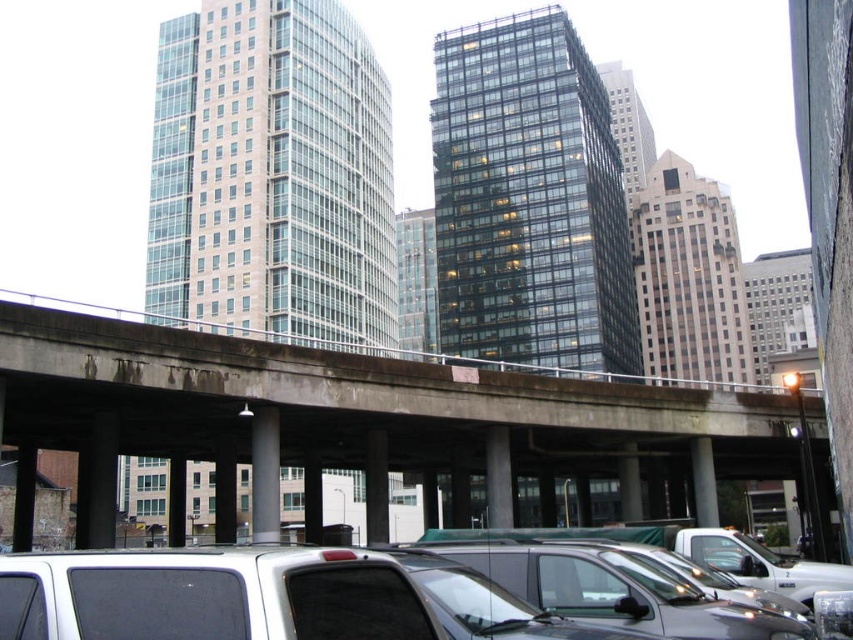
Is shiny black car at center behind white glossy truck at lower right?

That is False.

Between point (576, 595) and point (706, 563), which one is positioned in front?

Point (576, 595)

Locate an element on the screen. This screenshot has height=640, width=853. shiny black car at center is located at coordinates (614, 589).

Between concrete at center and white matte van at lower left, which one is positioned lower?

concrete at center is lower down.

Can you confirm if concrete at center is wider than white matte van at lower left?

Yes.

The height and width of the screenshot is (640, 853). I want to click on concrete at center, so click(x=357, y=404).

What are the coordinates of `concrete at center` in the screenshot? It's located at (357, 404).

Between white matte van at lower left and shiny black car at center, which one has more height?

white matte van at lower left

Measure the distance from white matte van at lower left to shiny black car at center.

The distance of white matte van at lower left from shiny black car at center is 5.18 meters.

Locate an element on the screen. The height and width of the screenshot is (640, 853). white matte van at lower left is located at coordinates (262, 596).